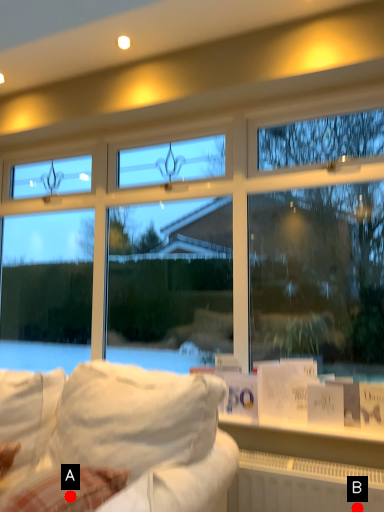
Question: Two points are circled on the image, labeled by A and B beside each circle. Which point is farther to the camera?

Choices:
 (A) A is further
 (B) B is further

Answer: (B)